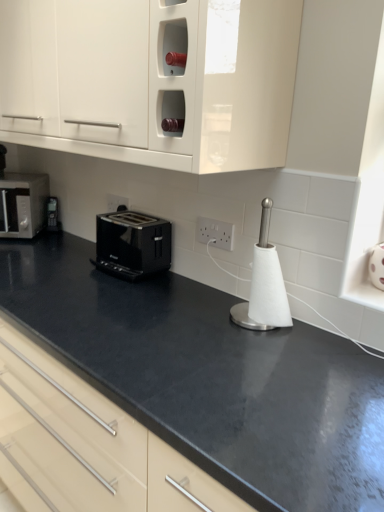
This screenshot has height=512, width=384. I want to click on free space above matte silver toaster at left (from a real-world perspective), so click(21, 174).